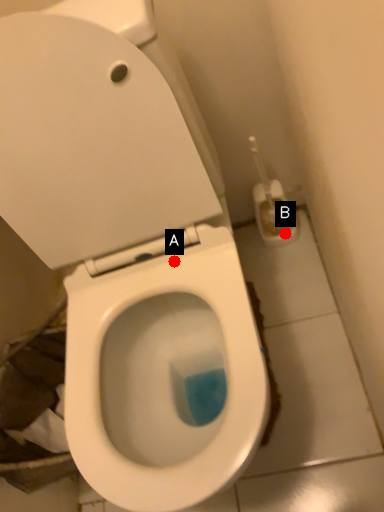
Question: Two points are circled on the image, labeled by A and B beside each circle. Which of the following is the farthest from the observer?

Choices:
 (A) A is further
 (B) B is further

Answer: (B)